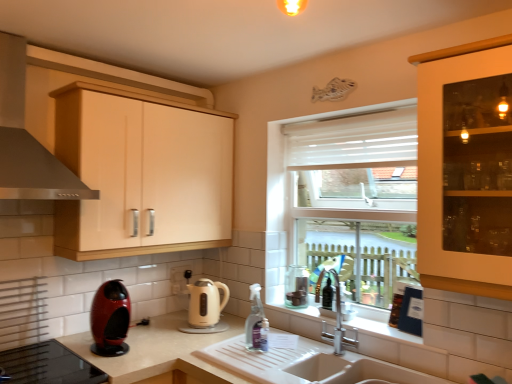
This screenshot has width=512, height=384. What are the coordinates of `vacant location below metallic red coffee machine at lower left (from a real-world perspective)` in the screenshot? It's located at pyautogui.click(x=111, y=347).